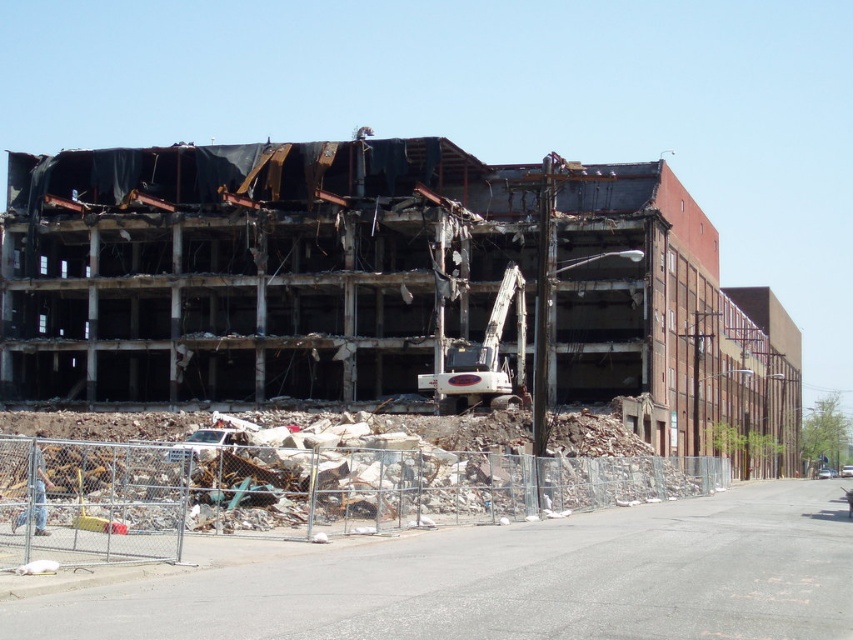
Question: Is rusty metal building at center smaller than white metallic excavator at center?

Choices:
 (A) no
 (B) yes

Answer: (A)

Question: Does rusty metal building at center have a greater width compared to white metallic excavator at center?

Choices:
 (A) yes
 (B) no

Answer: (A)

Question: Which point is closer to the camera taking this photo?

Choices:
 (A) (271, 289)
 (B) (498, 401)

Answer: (B)

Question: Where is rusty metal building at center located in relation to white metallic excavator at center in the image?

Choices:
 (A) right
 (B) left

Answer: (A)